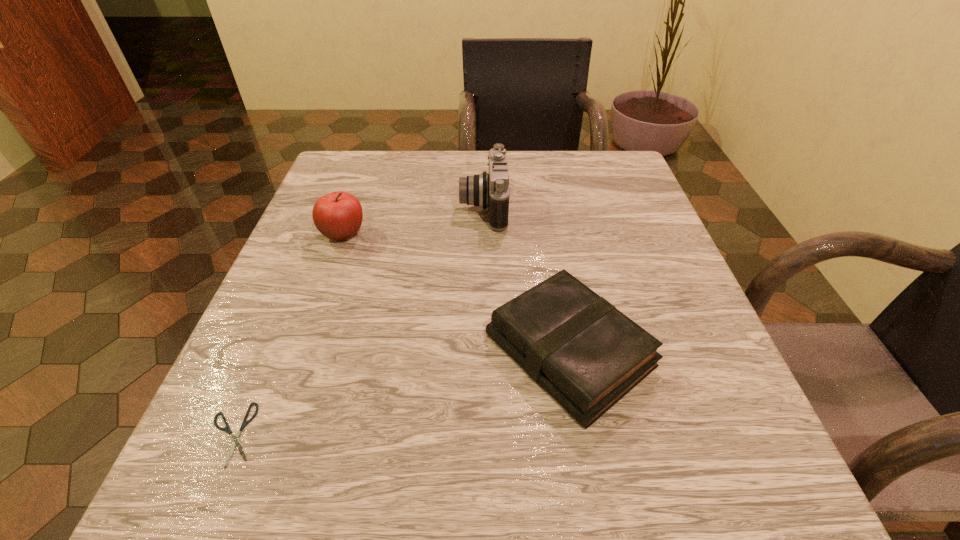
Locate an element on the screen. This screenshot has width=960, height=540. unoccupied area between the shears and the camera is located at coordinates (358, 321).

Locate an element on the screen. free space between the shortest object and the apple is located at coordinates coord(288,334).

Locate an element on the screen. The height and width of the screenshot is (540, 960). free space that is in between the camera and the second tallest object is located at coordinates (414, 220).

The width and height of the screenshot is (960, 540). I want to click on blank region between the camera and the shears, so click(358, 321).

Choose which object is the third nearest neighbor to the shortest object. Please provide its 2D coordinates. Your answer should be formatted as a tuple, i.e. [(x, y)], where the tuple contains the x and y coordinates of a point satisfying the conditions above.

[(485, 190)]

Identify the location of object that can be found as the third closest to the tallest object. (227, 429).

Locate an element on the screen. The width and height of the screenshot is (960, 540). vacant position in the image that satisfies the following two spatial constraints: 1. on the back side of the third tallest object; 2. on the front-facing side of the camera is located at coordinates (543, 207).

The width and height of the screenshot is (960, 540). In order to click on vacant area that satisfies the following two spatial constraints: 1. on the back side of the shears; 2. on the right side of the third tallest object in this screenshot , I will do `click(268, 350)`.

In order to click on free space that satisfies the following two spatial constraints: 1. on the front-facing side of the book; 2. on the right side of the tallest object in this screenshot , I will do `click(485, 350)`.

Find the location of `blank space that satisfies the following two spatial constraints: 1. on the back side of the third tallest object; 2. on the front-facing side of the tallest object`. blank space that satisfies the following two spatial constraints: 1. on the back side of the third tallest object; 2. on the front-facing side of the tallest object is located at coordinates (543, 207).